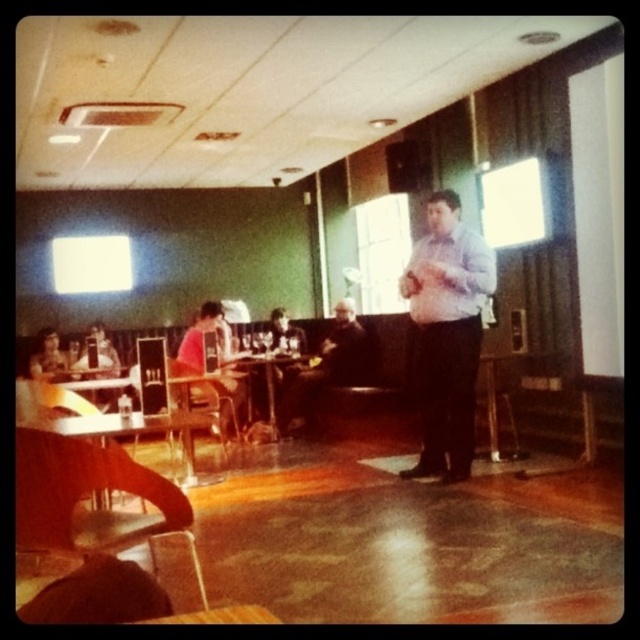
Can you confirm if white matte projection screen at upper right is shorter than matte black laptop at left?

No, white matte projection screen at upper right is not shorter than matte black laptop at left.

The image size is (640, 640). What are the coordinates of `white matte projection screen at upper right` in the screenshot? It's located at (515, 204).

Can you confirm if matte blue shirt at center is positioned to the right of white matte projection screen at upper right?

No, matte blue shirt at center is not to the right of white matte projection screen at upper right.

Which is behind, point (445, 467) or point (509, 225)?

The point (509, 225) is behind.

At what (x,y) coordinates should I click in order to perform the action: click on matte blue shirt at center. Please return your answer as a coordinate pair (x, y). This screenshot has height=640, width=640. Looking at the image, I should click on (448, 333).

Can you confirm if white glossy projector screen at upper left is taller than metallic silver chair at center?

Incorrect, white glossy projector screen at upper left's height is not larger of metallic silver chair at center's.

Does white glossy projector screen at upper left appear over metallic silver chair at center?

Correct, white glossy projector screen at upper left is located above metallic silver chair at center.

Is point (102, 276) positioned before point (186, 400)?

No, (102, 276) is behind (186, 400).

Where is `white glossy projector screen at upper left`? white glossy projector screen at upper left is located at coordinates (92, 262).